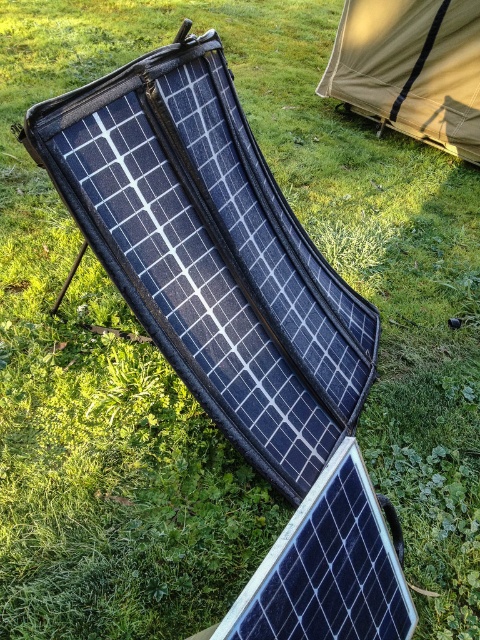
You are planning to set up a campsite and have both the black textured solar panel at center and the tan canvas tent at upper right. Which item takes up more area on the ground?

The tan canvas tent at upper right occupies more space than the black textured solar panel at center.

You are setting up camp and need to decide where to place your gear. The black textured solar panel at center and the tan canvas tent at upper right are already in place. Which object is closer to the ground?

The black textured solar panel at center is closer to the ground because it has a lesser height compared to the tan canvas tent at upper right.

You are setting up camp and need to decide where to place your gear. You have a black textured solar panel at center and a tan canvas tent at upper right. Which object is nearer to you, and why?

The black textured solar panel at center is closer to the viewer because it is positioned nearer than the tan canvas tent at upper right.